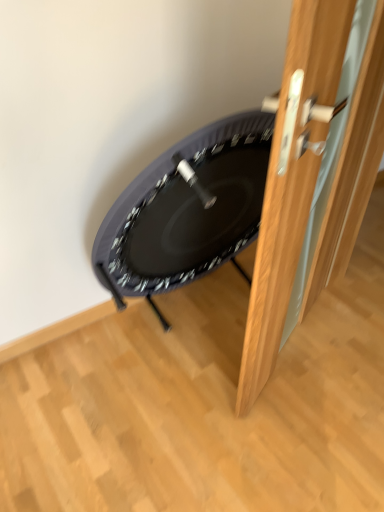
Where is `wooden door at right`? The height and width of the screenshot is (512, 384). wooden door at right is located at coordinates (315, 175).

This screenshot has width=384, height=512. What do you see at coordinates (315, 175) in the screenshot?
I see `wooden door at right` at bounding box center [315, 175].

Locate an element on the screen. wooden door at right is located at coordinates (315, 175).